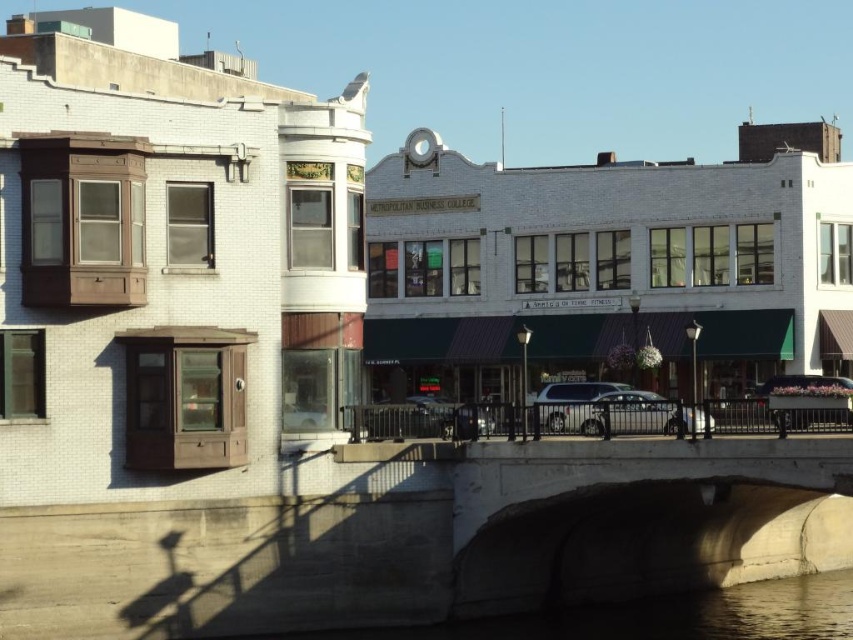
Question: Does silver metallic suv at center appear on the left side of metallic silver car at center?

Choices:
 (A) no
 (B) yes

Answer: (B)

Question: Is silver metallic suv at center smaller than metallic silver car at center?

Choices:
 (A) yes
 (B) no

Answer: (A)

Question: Among these points, which one is nearest to the camera?

Choices:
 (A) (590, 422)
 (B) (804, 378)

Answer: (A)

Question: From the image, what is the correct spatial relationship of silver metallic suv at center in relation to metallic silver car at center?

Choices:
 (A) left
 (B) right

Answer: (A)

Question: Which point appears farthest from the camera in this image?

Choices:
 (A) (711, 420)
 (B) (793, 417)

Answer: (A)

Question: Which point is farther from the camera taking this photo?

Choices:
 (A) (753, 394)
 (B) (593, 388)

Answer: (A)